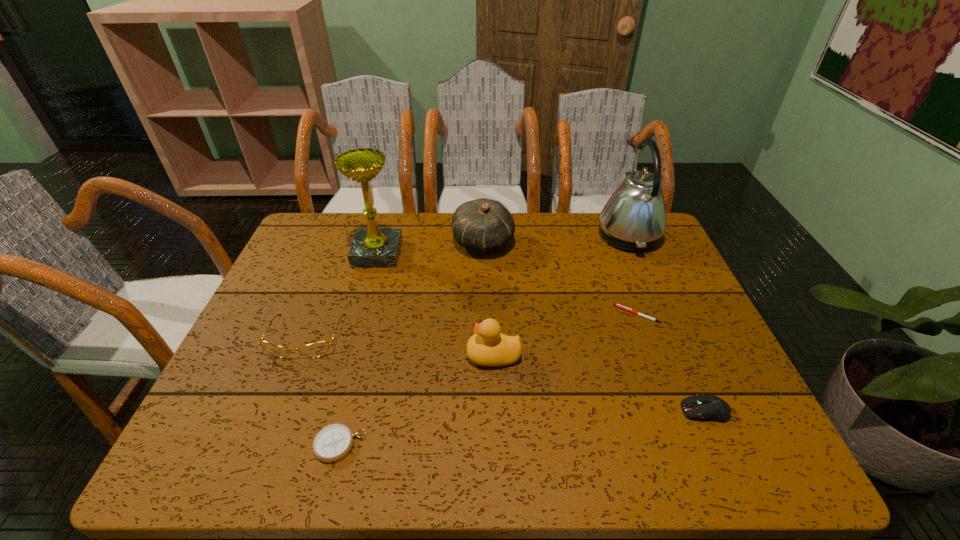
Where is `free location located on the button of the computer equipment`? Image resolution: width=960 pixels, height=540 pixels. free location located on the button of the computer equipment is located at coordinates (488, 411).

Where is `free point located on the button of the computer equipment`? This screenshot has height=540, width=960. free point located on the button of the computer equipment is located at coordinates (657, 411).

The height and width of the screenshot is (540, 960). Identify the location of free spot located 0.140m on the right of the seventh tallest object. (437, 445).

You are a GUI agent. You are given a task and a screenshot of the screen. Output one action in this format:
    pyautogui.click(x=<x>, y=<y>)
    Task: Click on the vacant space located on the clicker of the shortest object
    
    Given the screenshot: What is the action you would take?
    pyautogui.click(x=564, y=314)

The width and height of the screenshot is (960, 540). I want to click on free space located 0.400m on the clicker of the shortest object, so point(458,314).

Identify the location of vacant area situated 0.360m on the clicker of the shortest object. This screenshot has width=960, height=540. (473, 314).

Where is `kettle positioned at the far edge`? kettle positioned at the far edge is located at coordinates (634, 218).

What are the coordinates of `award that is at the far edge` in the screenshot? It's located at (371, 248).

At what (x,y) coordinates should I click in order to perform the action: click on gourd located at the far edge. Please return your answer as a coordinate pair (x, y). This screenshot has width=960, height=540. Looking at the image, I should click on (483, 225).

This screenshot has height=540, width=960. Find the location of `object that is at the near edge`. object that is at the near edge is located at coordinates (332, 443).